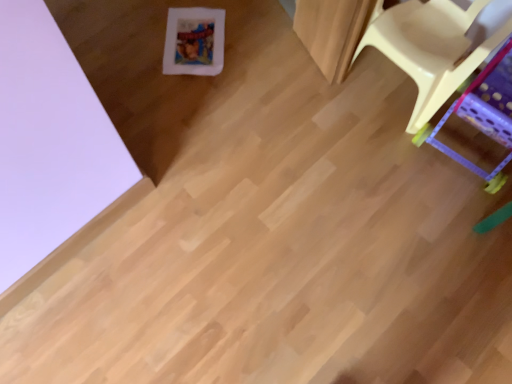
Locate an element on the screen. This screenshot has width=512, height=384. free region on the left part of yellow plastic chair at right, which appears as the 1th furniture when viewed from the right is located at coordinates (378, 160).